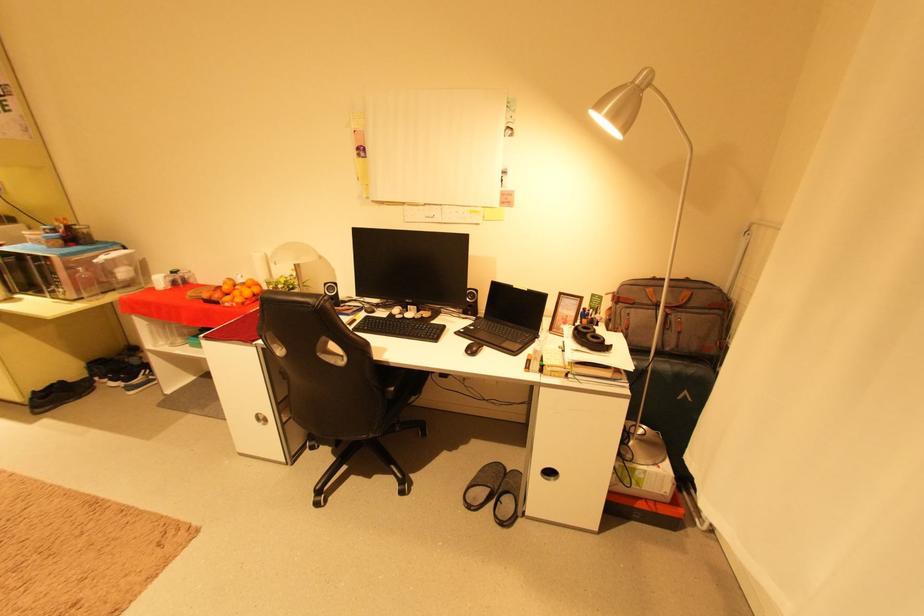
Locate an element on the screen. The image size is (924, 616). black laptop is located at coordinates (507, 318).